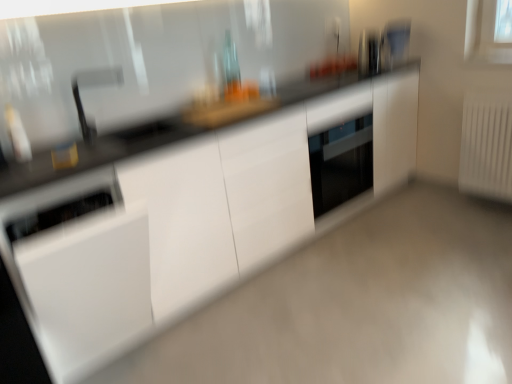
Question: Considering the positions of point (56, 170) and point (408, 31), is point (56, 170) closer or farther from the camera than point (408, 31)?

Choices:
 (A) closer
 (B) farther

Answer: (A)

Question: From the image's perspective, relative to satin silver toaster at upper right, which is the third appliance from front to back, is white glossy cabinet at center above or below?

Choices:
 (A) below
 (B) above

Answer: (A)

Question: Which is farther from the white glossy cabinet at center?

Choices:
 (A) white glossy dishwasher at lower left, which is counted as the third appliance, starting from the top
 (B) metallic stainless steel toaster at upper right, marked as the 2th appliance in a front-to-back arrangement
 (C) satin nickel faucet at upper left
 (D) satin silver toaster at upper right, the 1th appliance when ordered from top to bottom
 (E) white plastic radiator at right

Answer: (D)

Question: Which object is positioned closest to the white plastic radiator at right?

Choices:
 (A) white glossy cabinet at center
 (B) metallic stainless steel toaster at upper right, which is the second appliance from back to front
 (C) satin silver toaster at upper right, which is the 3th appliance in bottom-to-top order
 (D) white glossy dishwasher at lower left, which appears as the 3th appliance when viewed from the back
 (E) satin nickel faucet at upper left

Answer: (C)